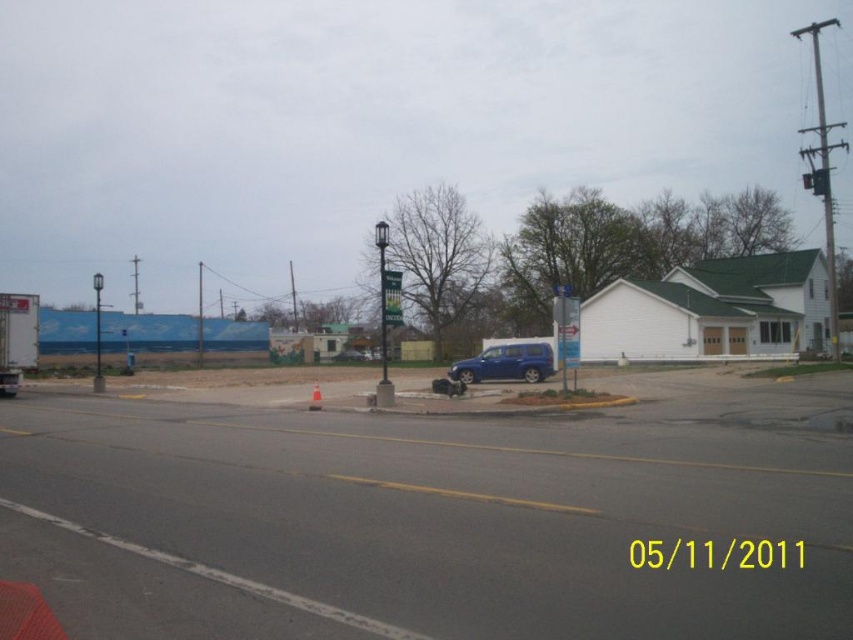
Question: Based on their relative distances, which object is nearer to the blue matte suv at center?

Choices:
 (A) white plastic cone at center
 (B) green fabric banner at center

Answer: (A)

Question: Among these points, which one is nearest to the camera?

Choices:
 (A) (543, 365)
 (B) (399, 300)
 (C) (318, 394)

Answer: (B)

Question: Is blue matte suv at center bigger than white plastic cone at center?

Choices:
 (A) yes
 (B) no

Answer: (A)

Question: Can you confirm if green fabric banner at center is positioned to the right of white plastic cone at center?

Choices:
 (A) yes
 (B) no

Answer: (A)

Question: Does blue matte suv at center appear on the right side of white plastic cone at center?

Choices:
 (A) yes
 (B) no

Answer: (A)

Question: Which point is closer to the camera taking this photo?

Choices:
 (A) (320, 400)
 (B) (532, 364)

Answer: (A)